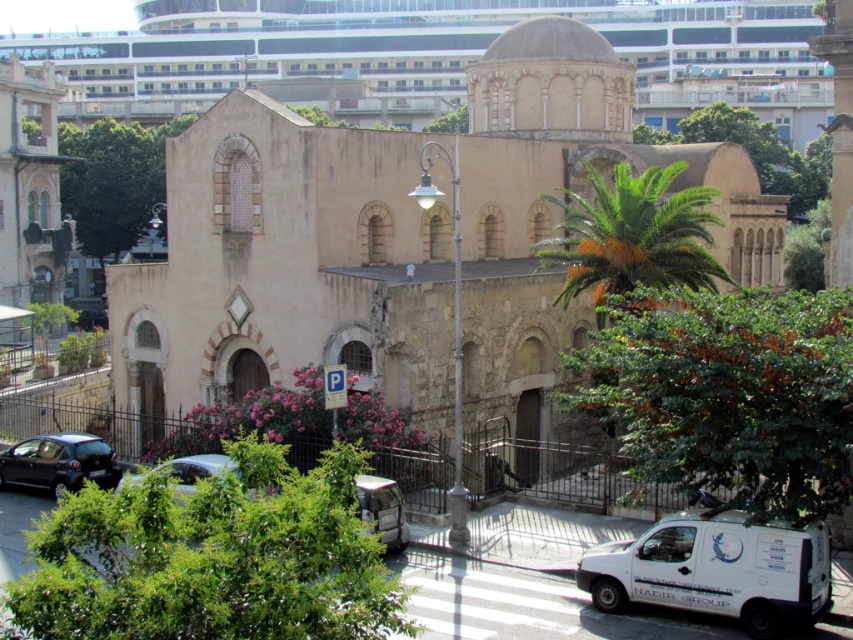
Can you confirm if metallic silver van at lower center is wider than metallic silver car at lower left?

In fact, metallic silver van at lower center might be narrower than metallic silver car at lower left.

Can you confirm if metallic silver van at lower center is positioned below metallic silver car at lower left?

Indeed, metallic silver van at lower center is positioned under metallic silver car at lower left.

Is point (390, 525) farther from camera compared to point (117, 490)?

That is False.

This screenshot has width=853, height=640. Find the location of `metallic silver van at lower center`. metallic silver van at lower center is located at coordinates (381, 509).

Between point (241, 182) and point (115, 468), which one is positioned in front?

Point (115, 468)

Can you confirm if beige stone church at center is positioned above shiny black car at lower left?

Correct, beige stone church at center is located above shiny black car at lower left.

This screenshot has height=640, width=853. Find the location of `beige stone church at center`. beige stone church at center is located at coordinates (402, 243).

Which is more to the left, white matte van at lower right or metallic silver van at lower center?

metallic silver van at lower center is more to the left.

Can you confirm if white matte van at lower right is shorter than metallic silver van at lower center?

No, white matte van at lower right is not shorter than metallic silver van at lower center.

Measure the distance between point (695, 515) and camera.

Point (695, 515) and camera are 32.26 meters apart.

You are a GUI agent. You are given a task and a screenshot of the screen. Output one action in this format:
    pyautogui.click(x=<x>, y=<y>)
    Task: Click on the white matte van at lower right
    
    Given the screenshot: What is the action you would take?
    pyautogui.click(x=717, y=570)